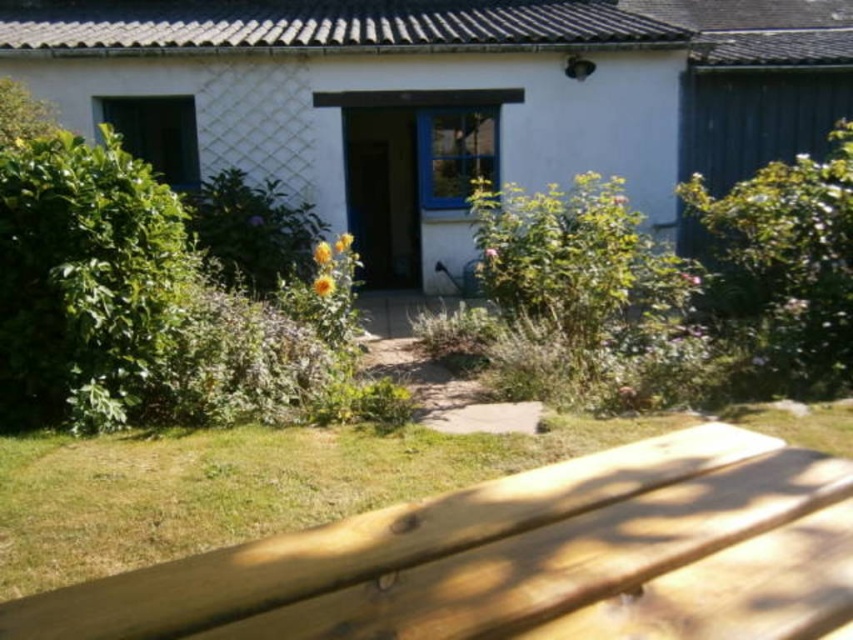
You are planning to place a new flower pot between the white painted wood cottage at center and the wooden bench at lower center. Considering their sizes, which object should the flower pot be closer to?

The white painted wood cottage at center is wider than the wooden bench at lower center, so the flower pot should be placed closer to the wooden bench at lower center to maintain balance between the two objects.

You are planning to place a new garden ornament that requires a space of 1 meter in width. Given the white painted wood cottage at center and the wooden bench at lower center, which object can accommodate this ornament without overlapping?

The white painted wood cottage at center can accommodate the garden ornament since it has a larger size compared to the wooden bench at lower center, providing enough space for the 1 meter width requirement.

You are a visitor approaching the white painted wood cottage at center and notice a wooden bench at lower center nearby. Which object would you see first as you walk towards the cottage?

The wooden bench at lower center would be seen first because it is closer to the visitor compared to the white painted wood cottage at center, which is taller but located further back.